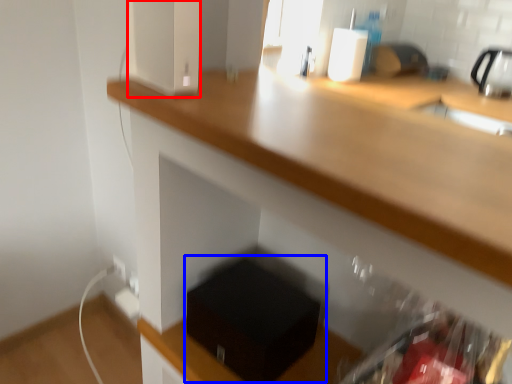
Question: Which object is further to the camera taking this photo, appliance (highlighted by a red box) or box (highlighted by a blue box)?

Choices:
 (A) appliance
 (B) box

Answer: (B)